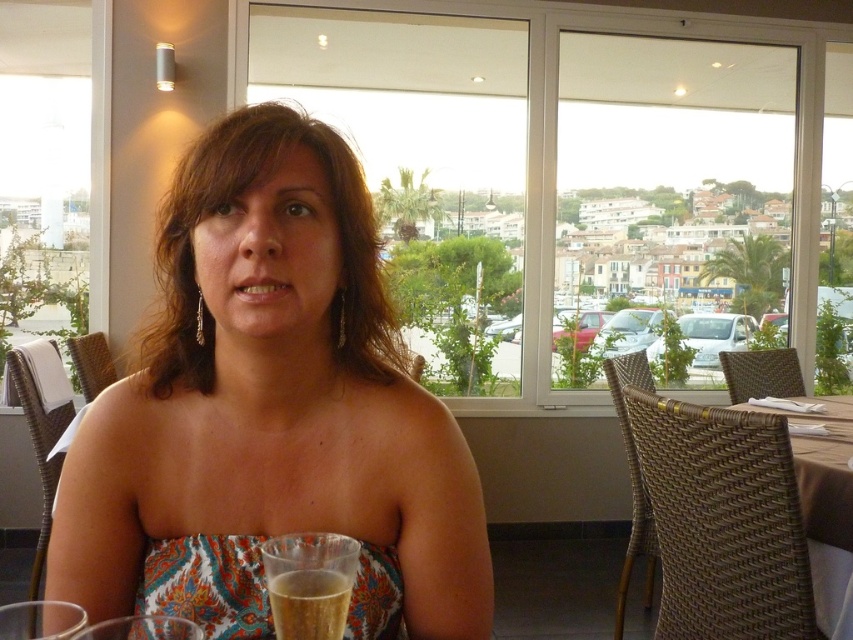
Describe the element at coordinates (270, 412) in the screenshot. I see `multicolored fabric dress at center` at that location.

Measure the distance between point [135,381] and camera.

A distance of 29.98 inches exists between point [135,381] and camera.

This screenshot has width=853, height=640. I want to click on multicolored fabric dress at center, so click(270, 412).

Who is positioned more to the right, transparent glass window at center or brown woven table at right?

Positioned to the right is brown woven table at right.

Does point (381, 179) come behind point (846, 412)?

Yes.

Locate an element on the screen. transparent glass window at center is located at coordinates (569, 170).

Based on the photo, can you confirm if multicolored fabric dress at center is smaller than printed fabric dress at lower center?

No.

In the scene shown: Between multicolored fabric dress at center and printed fabric dress at lower center, which one appears on the right side from the viewer's perspective?

From the viewer's perspective, printed fabric dress at lower center appears more on the right side.

Does point (190, 342) come farther from viewer compared to point (378, 570)?

Yes, point (190, 342) is farther from viewer.

Image resolution: width=853 pixels, height=640 pixels. In order to click on multicolored fabric dress at center in this screenshot , I will do `click(270, 412)`.